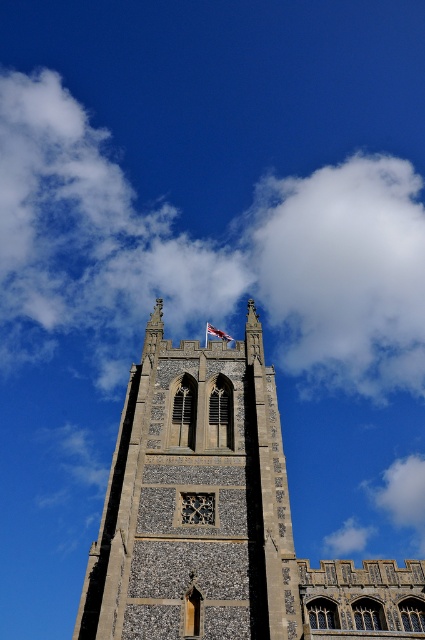
Question: Is white fluffy cloud at upper center thinner than red fabric flag at center?

Choices:
 (A) no
 (B) yes

Answer: (A)

Question: Does white fluffy cloud at upper center have a greater width compared to red fabric flag at center?

Choices:
 (A) no
 (B) yes

Answer: (B)

Question: Which object appears closest to the camera in this image?

Choices:
 (A) white fluffy cloud at upper center
 (B) stone tower at center
 (C) red fabric flag at center

Answer: (B)

Question: Which of the following is the farthest from the observer?

Choices:
 (A) (311, 323)
 (B) (257, 460)

Answer: (A)

Question: Estimate the real-world distances between objects in this image. Which object is closer to the white fluffy cloud at upper center?

Choices:
 (A) red fabric flag at center
 (B) stone tower at center

Answer: (A)

Question: Can you confirm if stone tower at center is positioned to the right of red fabric flag at center?

Choices:
 (A) no
 (B) yes

Answer: (A)